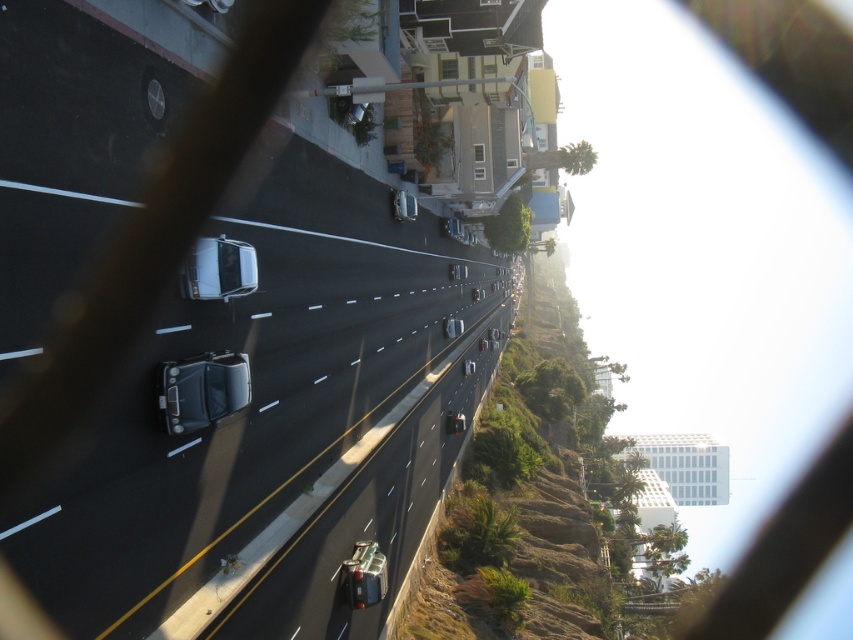
You are a pedestrian standing on the sidewalk to the left of the highway. You see a shiny black car at center and a metallic silver car at lower right. Which car is closer to the buildings?

The shiny black car at center is closer to the buildings because it is located above the metallic silver car at lower right, which means it is positioned nearer to the sidewalk and the buildings beyond.